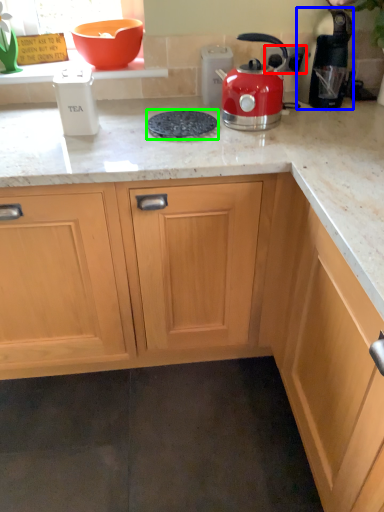
Question: Based on their relative distances, which object is nearer to electric outlet (highlighted by a red box)? Choose from kitchen appliance (highlighted by a blue box) and gas stove (highlighted by a green box).

Choices:
 (A) kitchen appliance
 (B) gas stove

Answer: (A)